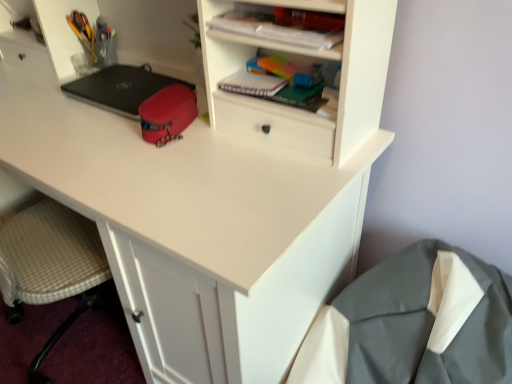
Where is `plaid paper notebook at upper center`? This screenshot has height=384, width=512. plaid paper notebook at upper center is located at coordinates (252, 84).

Where is `matte red pouch at center, which appears as the 1th stationery when viewed from the front`? matte red pouch at center, which appears as the 1th stationery when viewed from the front is located at coordinates pos(167,114).

The image size is (512, 384). What do you see at coordinates (120, 88) in the screenshot?
I see `black matte laptop at center` at bounding box center [120, 88].

Locate an element on the screen. The height and width of the screenshot is (384, 512). matte plastic notebook at upper center is located at coordinates (275, 29).

You are a GUI agent. You are given a task and a screenshot of the screen. Output one action in this format:
    pyautogui.click(x=<x>, y=<y>)
    Task: Click on the sleeping bag in front of the matte plastic notebook at upper center
    This screenshot has width=512, height=384.
    Given the screenshot: What is the action you would take?
    pyautogui.click(x=414, y=323)

Considering the points (246, 24) and (316, 332), which point is in front, point (246, 24) or point (316, 332)?

Point (246, 24)

Which is behind, matte plastic notebook at upper center or gray fabric sleeping bag at lower right?

Positioned behind is matte plastic notebook at upper center.

Considering the sizes of objects matte plastic notebook at upper center and gray fabric sleeping bag at lower right in the image provided, who is wider, matte plastic notebook at upper center or gray fabric sleeping bag at lower right?

gray fabric sleeping bag at lower right.

Does point (259, 82) appear closer or farther from the camera than point (256, 29)?

Point (259, 82) appears to be farther away from the viewer than point (256, 29).

From the picture: Is plaid paper notebook at upper center turned away from matte plastic notebook at upper center?

No, plaid paper notebook at upper center is not facing away from matte plastic notebook at upper center.

In the image, there is a matte plastic notebook at upper center. What are the coordinates of `notebook below it (from a real-world perspective)` in the screenshot? It's located at (252, 84).

Can you tell me how much plaid paper notebook at upper center and matte plastic notebook at upper center differ in facing direction?

The facing directions of plaid paper notebook at upper center and matte plastic notebook at upper center are 1.17 degrees apart.

Considering the points (182, 129) and (245, 75), which point is in front, point (182, 129) or point (245, 75)?

Positioned in front is point (182, 129).

In the scene shown: Considering the relative sizes of matte red pouch at center, which appears as the 1th stationery when viewed from the front, and plaid paper notebook at upper center in the image provided, is matte red pouch at center, which appears as the 1th stationery when viewed from the front, taller than plaid paper notebook at upper center?

Yes, matte red pouch at center, which appears as the 1th stationery when viewed from the front, is taller than plaid paper notebook at upper center.

Do you think matte red pouch at center, arranged as the first stationery when viewed from the right, is within plaid paper notebook at upper center, or outside of it?

matte red pouch at center, arranged as the first stationery when viewed from the right, is outside plaid paper notebook at upper center.

From the image's perspective, is matte red pouch at center, arranged as the first stationery when viewed from the right, positioned above or below plaid paper notebook at upper center?

matte red pouch at center, arranged as the first stationery when viewed from the right, is below plaid paper notebook at upper center.

Considering the sizes of objects matte plastic notebook at upper center and plaid paper notebook at upper center in the image provided, who is taller, matte plastic notebook at upper center or plaid paper notebook at upper center?

matte plastic notebook at upper center is taller.

Is matte plastic notebook at upper center positioned with its back to plaid paper notebook at upper center?

matte plastic notebook at upper center does not have its back to plaid paper notebook at upper center.

From a real-world perspective, which is physically above, matte plastic notebook at upper center or plaid paper notebook at upper center?

matte plastic notebook at upper center, from a real-world perspective.

Which object is wider, matte plastic notebook at upper center or plaid paper notebook at upper center?

With larger width is matte plastic notebook at upper center.

Based on the photo, is gray fabric sleeping bag at lower right spatially inside metallic pen holder at upper left, arranged as the 1th stationery when viewed from the top, or outside of it?

Result: gray fabric sleeping bag at lower right is spatially situated outside metallic pen holder at upper left, arranged as the 1th stationery when viewed from the top.

Between point (488, 370) and point (86, 46), which one is positioned in front?

Point (488, 370)

Looking at this image, from their relative heights in the image, would you say gray fabric sleeping bag at lower right is taller or shorter than metallic pen holder at upper left, which is the second stationery from bottom to top?

Clearly, gray fabric sleeping bag at lower right is taller compared to metallic pen holder at upper left, which is the second stationery from bottom to top.

In the scene shown: Which object is thinner, gray fabric sleeping bag at lower right or metallic pen holder at upper left, positioned as the 2th stationery in right-to-left order?

metallic pen holder at upper left, positioned as the 2th stationery in right-to-left order, is thinner.

From their relative heights in the image, would you say plaid paper notebook at upper center is taller or shorter than metallic pen holder at upper left, the second stationery viewed from the front?

plaid paper notebook at upper center is shorter than metallic pen holder at upper left, the second stationery viewed from the front.

From a real-world perspective, is plaid paper notebook at upper center under metallic pen holder at upper left, the first stationery when ordered from back to front?

No, from a real-world perspective, plaid paper notebook at upper center is not below metallic pen holder at upper left, the first stationery when ordered from back to front.

Between plaid paper notebook at upper center and metallic pen holder at upper left, the first stationery when ordered from back to front, which one has larger size?

metallic pen holder at upper left, the first stationery when ordered from back to front, is bigger.

Considering the relative sizes of plaid paper notebook at upper center and metallic pen holder at upper left, the second stationery viewed from the front, in the image provided, is plaid paper notebook at upper center thinner than metallic pen holder at upper left, the second stationery viewed from the front,?

Yes.

Considering their positions, is matte plastic notebook at upper center located in front of or behind black matte laptop at center?

Visually, matte plastic notebook at upper center is located in front of black matte laptop at center.

From the image's perspective, is matte plastic notebook at upper center positioned above or below black matte laptop at center?

matte plastic notebook at upper center is situated higher than black matte laptop at center in the image.

What's the angular difference between matte plastic notebook at upper center and black matte laptop at center's facing directions?

There is a 1.17-degree angle between the facing directions of matte plastic notebook at upper center and black matte laptop at center.

At what (x,y) coordinates should I click in order to perform the action: click on sleeping bag in front of the matte plastic notebook at upper center. Please return your answer as a coordinate pair (x, y). The height and width of the screenshot is (384, 512). Looking at the image, I should click on (414, 323).

Find the location of a particular element. The width and height of the screenshot is (512, 384). notebook located on the left of matte plastic notebook at upper center is located at coordinates (252, 84).

From the image, which object appears to be farther from matte plastic notebook at upper center, black matte laptop at center or metallic pen holder at upper left, the first stationery when ordered from back to front?

The object further to matte plastic notebook at upper center is metallic pen holder at upper left, the first stationery when ordered from back to front.

Looking at the image, which one is located further to plaid paper notebook at upper center, matte red pouch at center, the first stationery from the bottom, or metallic pen holder at upper left, arranged as the 1th stationery when viewed from the top?

metallic pen holder at upper left, arranged as the 1th stationery when viewed from the top, is further to plaid paper notebook at upper center.

Based on their spatial positions, is black matte laptop at center or plaid paper notebook at upper center further from metallic pen holder at upper left, the first stationery when ordered from back to front?

Among the two, plaid paper notebook at upper center is located further to metallic pen holder at upper left, the first stationery when ordered from back to front.

Which object lies further to the anchor point black matte laptop at center, gray fabric sleeping bag at lower right or metallic pen holder at upper left, positioned as the 2th stationery in right-to-left order?

gray fabric sleeping bag at lower right.

Considering their positions, is gray fabric sleeping bag at lower right positioned closer to matte plastic notebook at upper center than matte red pouch at center, the first stationery from the bottom?

matte red pouch at center, the first stationery from the bottom, lies closer to matte plastic notebook at upper center than the other object.

From the picture: Based on their spatial positions, is metallic pen holder at upper left, which is the second stationery from bottom to top, or matte red pouch at center, the second stationery when ordered from top to bottom, further from gray fabric sleeping bag at lower right?

Based on the image, metallic pen holder at upper left, which is the second stationery from bottom to top, appears to be further to gray fabric sleeping bag at lower right.

When comparing their distances from metallic pen holder at upper left, arranged as the 1th stationery when viewed from the top, does gray fabric sleeping bag at lower right or black matte laptop at center seem further?

gray fabric sleeping bag at lower right lies further to metallic pen holder at upper left, arranged as the 1th stationery when viewed from the top, than the other object.

From the image, which object appears to be farther from black matte laptop at center, matte red pouch at center, the 2th stationery in the left-to-right sequence, or plaid paper notebook at upper center?

Among the two, plaid paper notebook at upper center is located further to black matte laptop at center.

Identify the location of stationery located between black matte laptop at center and plaid paper notebook at upper center in the left-right direction. (x=167, y=114).

Find the location of a particular element. Image resolution: width=512 pixels, height=384 pixels. notebook that lies between metallic pen holder at upper left, the second stationery viewed from the front, and gray fabric sleeping bag at lower right from top to bottom is located at coordinates (252, 84).

Identify the location of notebook between matte plastic notebook at upper center and gray fabric sleeping bag at lower right vertically. This screenshot has width=512, height=384. (252, 84).

At what (x,y) coordinates should I click in order to perform the action: click on stationery between matte plastic notebook at upper center and gray fabric sleeping bag at lower right from top to bottom. Please return your answer as a coordinate pair (x, y). Looking at the image, I should click on (167, 114).